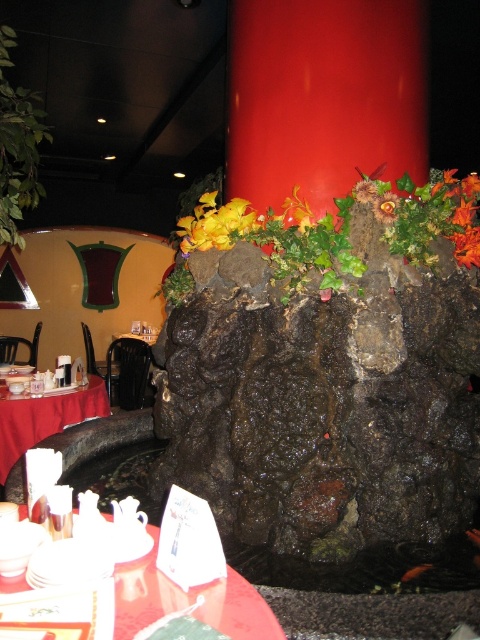
Question: Is yellow fabric flower at center in front of yellow matte flower at upper center?

Choices:
 (A) no
 (B) yes

Answer: (A)

Question: Does red satin tablecloth at lower left appear on the right side of yellow fabric flower at center?

Choices:
 (A) yes
 (B) no

Answer: (B)

Question: Estimate the real-world distances between objects in this image. Which object is closer to the dark rock at center?

Choices:
 (A) matte red table at lower left
 (B) yellow matte flower at upper center
 (C) yellow fabric flower at center
 (D) leaves and flowers at center

Answer: (D)

Question: Which of the following is the closest to the observer?

Choices:
 (A) orange matte flower at center
 (B) yellow fabric flower at center

Answer: (A)

Question: Does matte red table at lower left appear under orange matte flower at center?

Choices:
 (A) no
 (B) yes

Answer: (B)

Question: Which point appears closest to the camera in this image?

Choices:
 (A) (360, 186)
 (B) (202, 612)

Answer: (B)